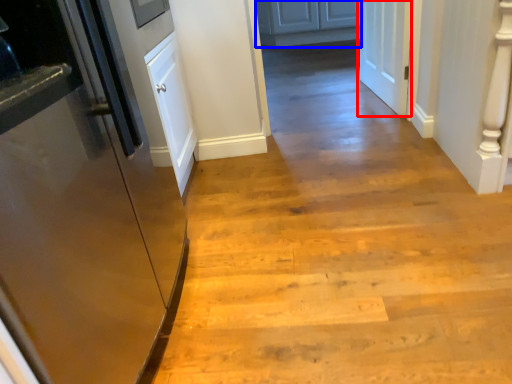
Question: Which of the following is the farthest to the observer, door (highlighted by a red box) or cabinetry (highlighted by a blue box)?

Choices:
 (A) door
 (B) cabinetry

Answer: (B)